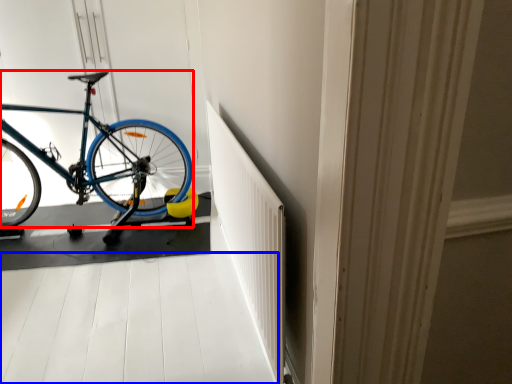
Question: Which point is further to the camera, bicycle (highlighted by a red box) or path (highlighted by a blue box)?

Choices:
 (A) bicycle
 (B) path

Answer: (A)